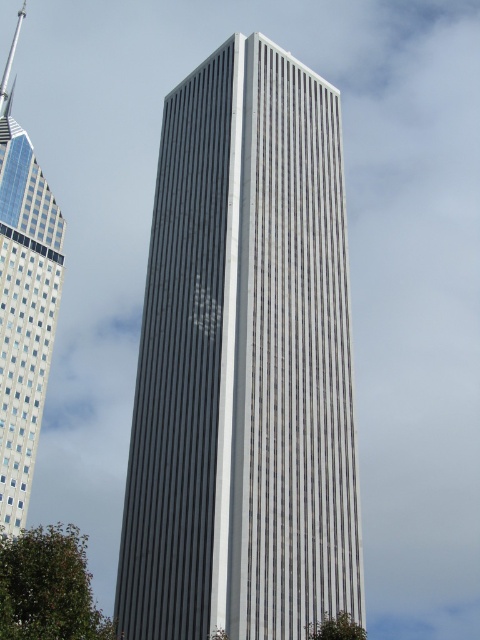
Is gray/white glass skyscraper at center wider than glassy reflective skyscraper at left?

Yes, gray/white glass skyscraper at center is wider than glassy reflective skyscraper at left.

Does gray/white glass skyscraper at center have a lesser width compared to glassy reflective skyscraper at left?

Incorrect, gray/white glass skyscraper at center's width is not less than glassy reflective skyscraper at left's.

You are a GUI agent. You are given a task and a screenshot of the screen. Output one action in this format:
    pyautogui.click(x=<x>, y=<y>)
    Task: Click on the gray/white glass skyscraper at center
    This screenshot has height=640, width=480.
    Given the screenshot: What is the action you would take?
    (243, 364)

Where is `gray/white glass skyscraper at center`? The width and height of the screenshot is (480, 640). gray/white glass skyscraper at center is located at coordinates (243, 364).